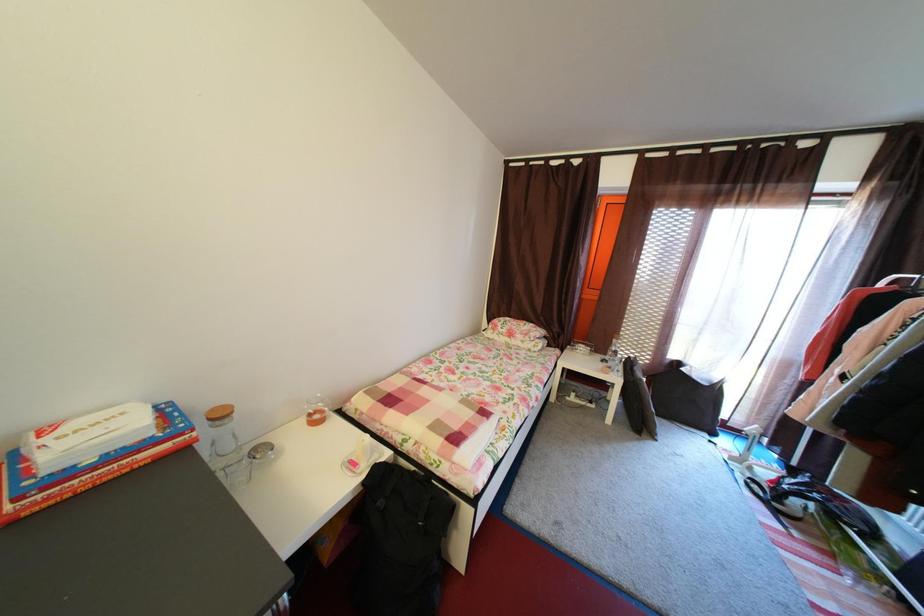
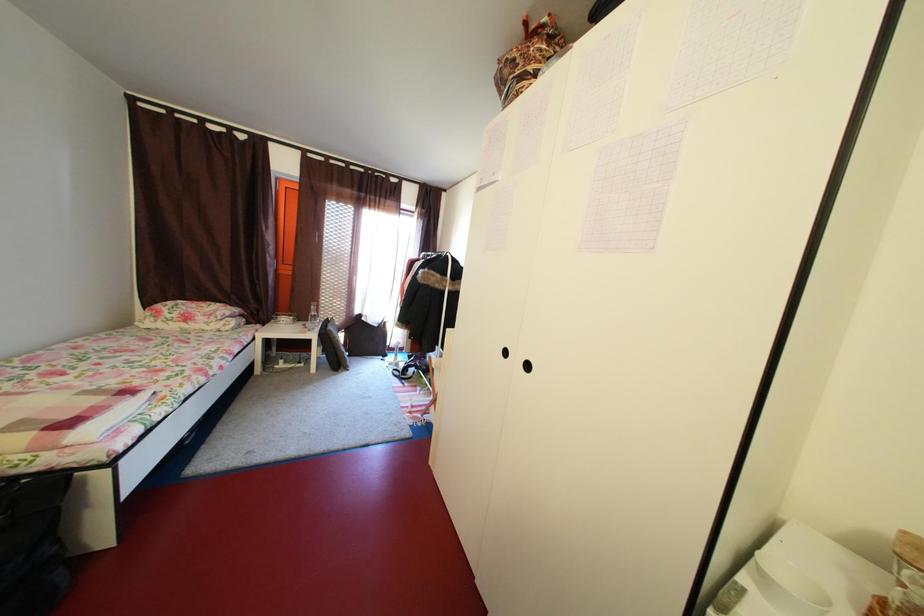
Question: The images are taken continuously from a first-person perspective. In which direction is your viewpoint rotating?

Choices:
 (A) Left
 (B) Right
 (C) Up
 (D) Down

Answer: (B)